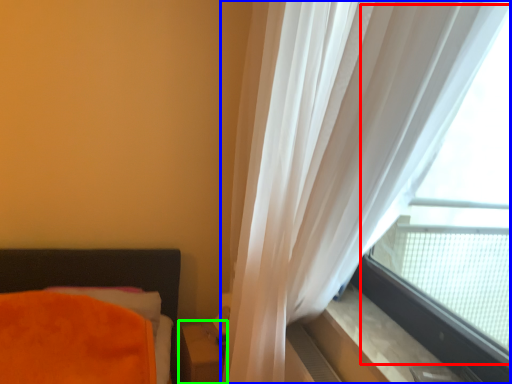
Question: Estimate the real-world distances between objects in this image. Which object is closer to bay window (highlighted by a red box), curtain (highlighted by a blue box) or table (highlighted by a green box)?

Choices:
 (A) curtain
 (B) table

Answer: (A)